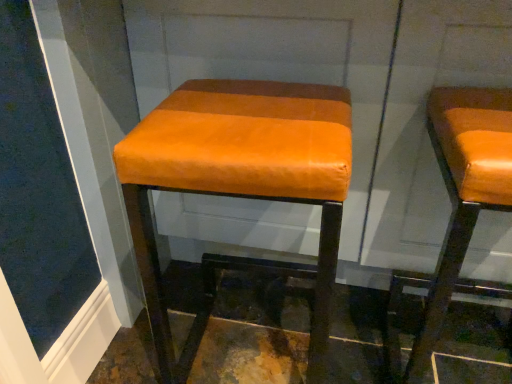
Find the location of a particular element. blank space above orange leather stool at center, marked as the second stool in a right-to-left arrangement (from a real-world perspective) is located at coordinates (248, 115).